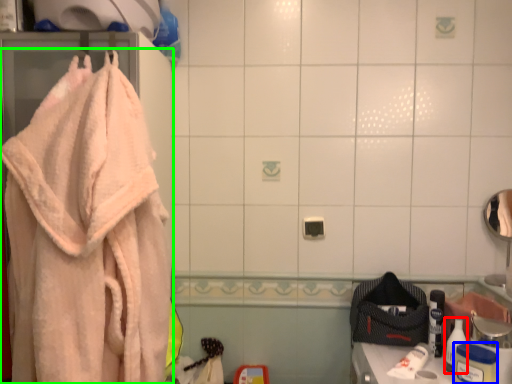
Question: Considering the real-world distances, which object is closest to toiletry (highlighted by a red box)? toiletry (highlighted by a blue box) or towel (highlighted by a green box).

Choices:
 (A) toiletry
 (B) towel

Answer: (A)